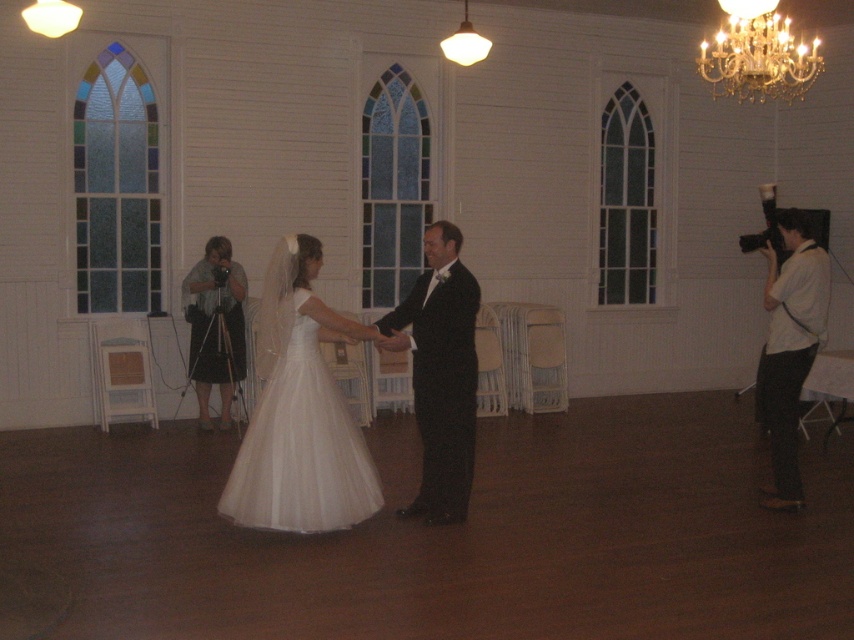
You are a photographer at the wedding reception. You need to capture a photo of the black satin tuxedo at center and the white shirt at right. Which one is positioned to the left side of the other?

The black satin tuxedo at center is to the left of the white shirt at right.

You are a photographer at the wedding reception. You need to take a photo of the black satin tuxedo at center and the white shirt at right. Which one is shorter in height?

The black satin tuxedo at center is shorter in height than the white shirt at right.